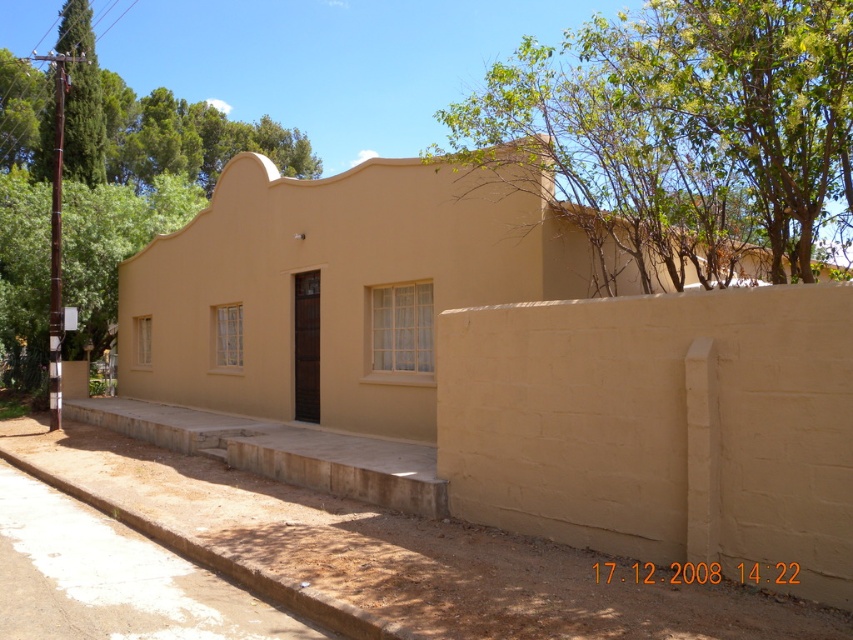
You are standing in front of the building and want to take a photo that includes both the dark wooden door and the green leafy tree at upper left. Based on their positions, will the tree appear to the left or right of the door in the photo?

The green leafy tree at upper left is located at point (155,129), which places it to the left of the dark wooden door centrally located between the windows. Therefore, in the photo, the tree will appear to the left of the door.

You are standing in front of the building and want to determine which of the two points, point (712, 240) or point (67, 51), is closer to you. Based on the scene description, which point is nearer?

Point (712, 240) is closer to the viewer than point 0.080, 0.080.